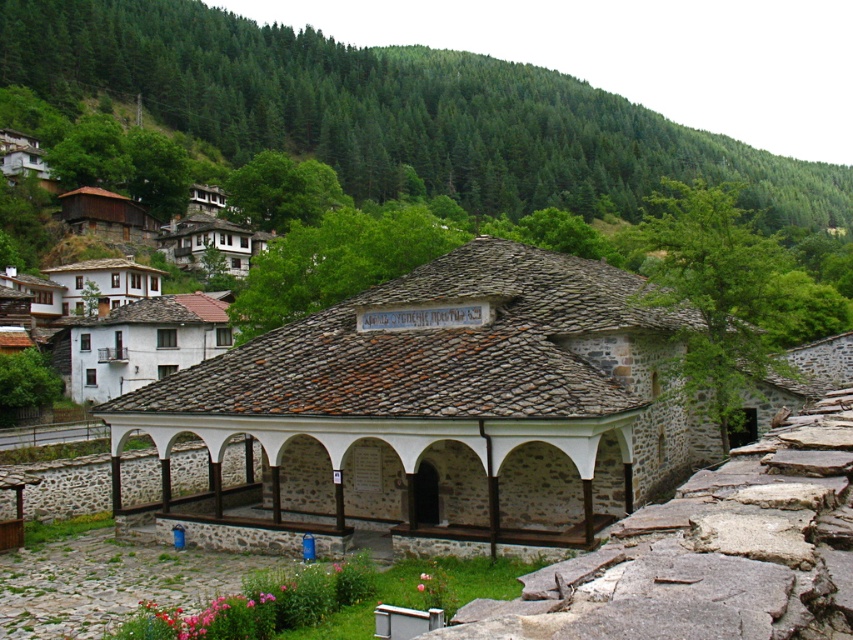
Is point (448, 540) more distant than point (155, 132)?

No, it is in front of (155, 132).

Which is below, stone/rough pergola at center or white stone building at center?

Positioned lower is stone/rough pergola at center.

What do you see at coordinates (440, 406) in the screenshot?
I see `stone/rough pergola at center` at bounding box center [440, 406].

This screenshot has height=640, width=853. Find the location of `stone/rough pergola at center`. stone/rough pergola at center is located at coordinates (440, 406).